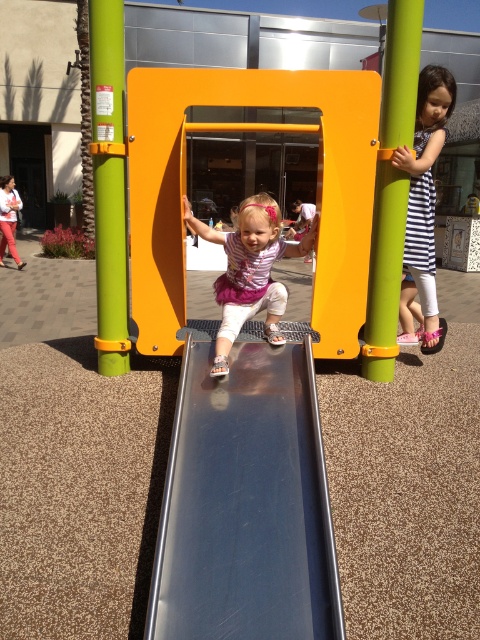
Is matte pink dress at center smaller than striped fabric dress at right?

Yes, matte pink dress at center is smaller than striped fabric dress at right.

Does matte pink dress at center lie behind striped fabric dress at right?

No, it is not.

Which is in front, point (275, 221) or point (419, 296)?

Point (275, 221) is in front.

Locate an element on the screen. The image size is (480, 640). matte pink dress at center is located at coordinates (250, 272).

Is metallic smooth slide at center taller than matte pink dress at center?

In fact, metallic smooth slide at center may be shorter than matte pink dress at center.

Who is shorter, metallic smooth slide at center or matte pink dress at center?

Standing shorter between the two is metallic smooth slide at center.

I want to click on metallic smooth slide at center, so click(x=245, y=504).

At what (x,y) coordinates should I click in order to perform the action: click on metallic smooth slide at center. Please return your answer as a coordinate pair (x, y). Image resolution: width=480 pixels, height=640 pixels. Looking at the image, I should click on [x=245, y=504].

Does metallic smooth slide at center have a larger size compared to striped fabric dress at right?

No.

Between point (233, 472) and point (404, 330), which one is positioned in front?

Point (233, 472) is more forward.

This screenshot has width=480, height=640. What are the coordinates of `metallic smooth slide at center` in the screenshot? It's located at (245, 504).